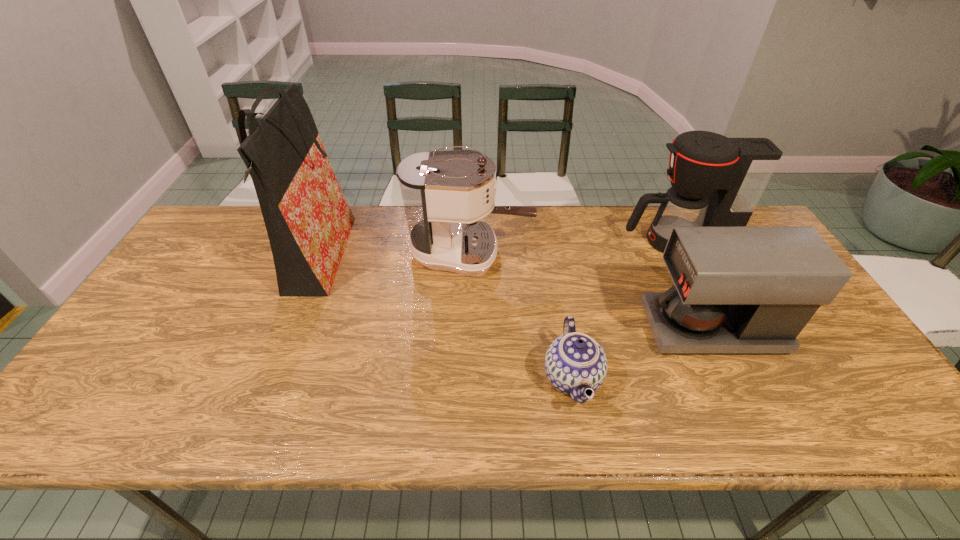
The width and height of the screenshot is (960, 540). Find the location of `free space at the right edge of the desktop`. free space at the right edge of the desktop is located at coordinates (851, 384).

In the image, there is a desktop. Identify the location of vacant region at the near left corner. The width and height of the screenshot is (960, 540). (121, 429).

Image resolution: width=960 pixels, height=540 pixels. I want to click on free space that is in between the leftmost coffee maker and the shortest coffee maker, so click(591, 291).

Find the location of a particular element. This screenshot has width=960, height=540. vacant space in between the chinaware and the shortest coffee maker is located at coordinates (642, 353).

This screenshot has height=540, width=960. What are the coordinates of `empty location between the leftmost coffee maker and the leftmost object` in the screenshot? It's located at (394, 256).

The width and height of the screenshot is (960, 540). Identify the location of free space between the shopping bag and the shortest object. (444, 319).

Where is `free space between the shortest coffee maker and the chinaware`? This screenshot has height=540, width=960. free space between the shortest coffee maker and the chinaware is located at coordinates (642, 353).

Locate an element on the screen. vacant space that's between the shortest object and the fourth tallest object is located at coordinates (642, 353).

The width and height of the screenshot is (960, 540). Identify the location of vacant area that lies between the shopping bag and the leftmost coffee maker. (394, 256).

This screenshot has width=960, height=540. Find the location of `object identified as the fourth closest to the leftmost coffee maker`. object identified as the fourth closest to the leftmost coffee maker is located at coordinates pos(716,181).